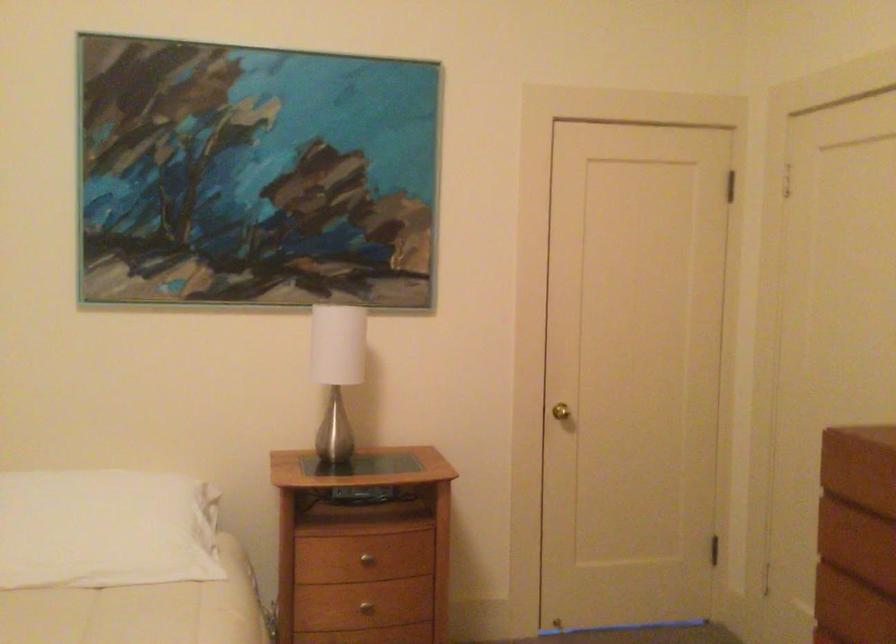
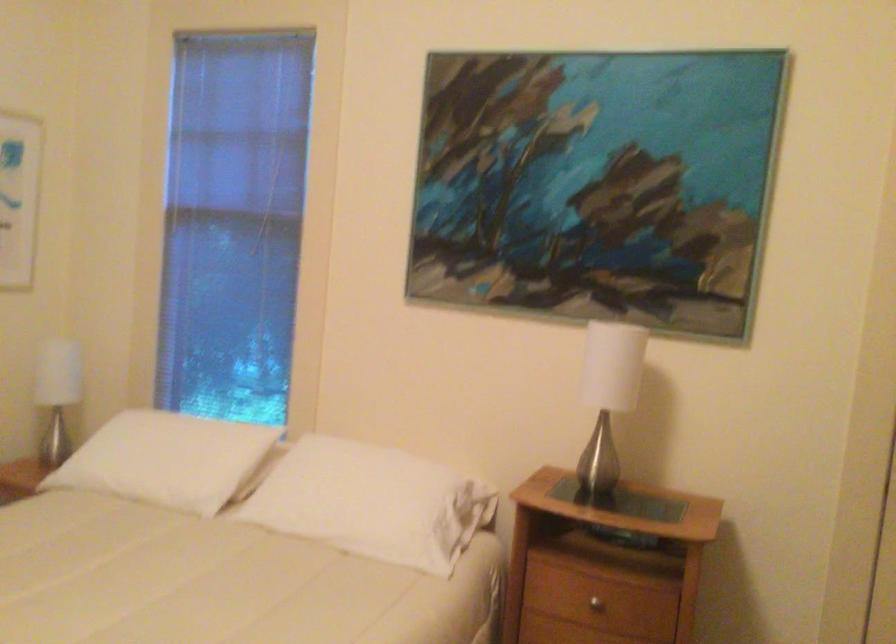
Locate, in the second image, the point that corresponds to pixel 364 564 in the first image.

(597, 601)